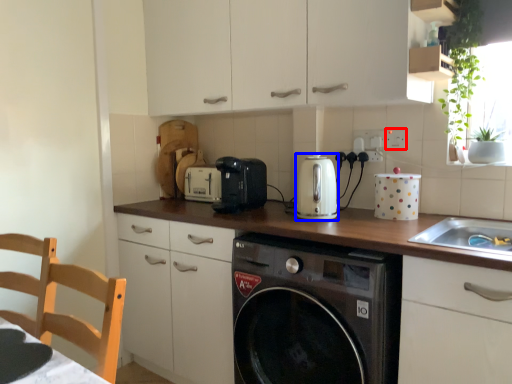
Question: Which object is closer to the camera taking this photo, electric outlet (highlighted by a red box) or kitchen appliance (highlighted by a blue box)?

Choices:
 (A) electric outlet
 (B) kitchen appliance

Answer: (B)